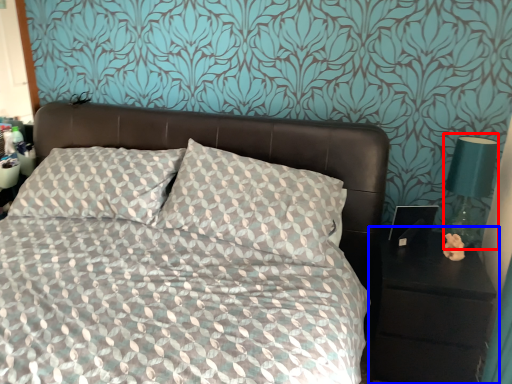
Question: Among these objects, which one is farthest to the camera, bedside lamp (highlighted by a red box) or nightstand (highlighted by a blue box)?

Choices:
 (A) bedside lamp
 (B) nightstand

Answer: (A)